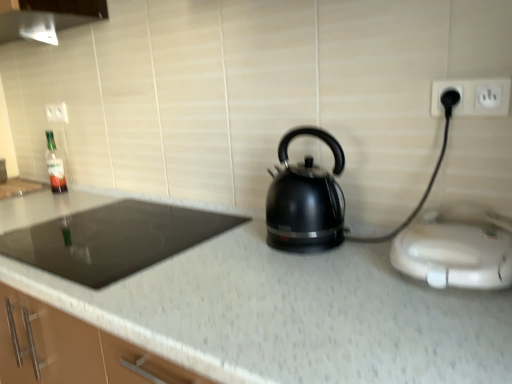
Locate an element on the screen. vacant space to the left of black glossy kettle at center is located at coordinates (224, 251).